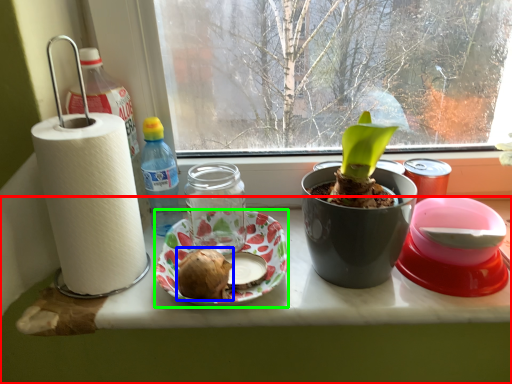
Question: Which object is positioned closest to table (highlighted by a red box)? Select from food (highlighted by a blue box) and platter (highlighted by a green box).

Choices:
 (A) food
 (B) platter

Answer: (B)